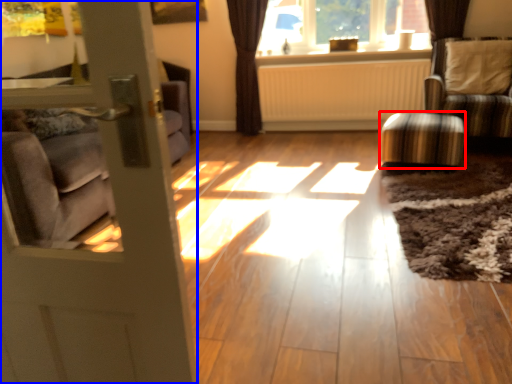
Question: Which object is further to the camera taking this photo, stool (highlighted by a red box) or door (highlighted by a blue box)?

Choices:
 (A) stool
 (B) door

Answer: (A)